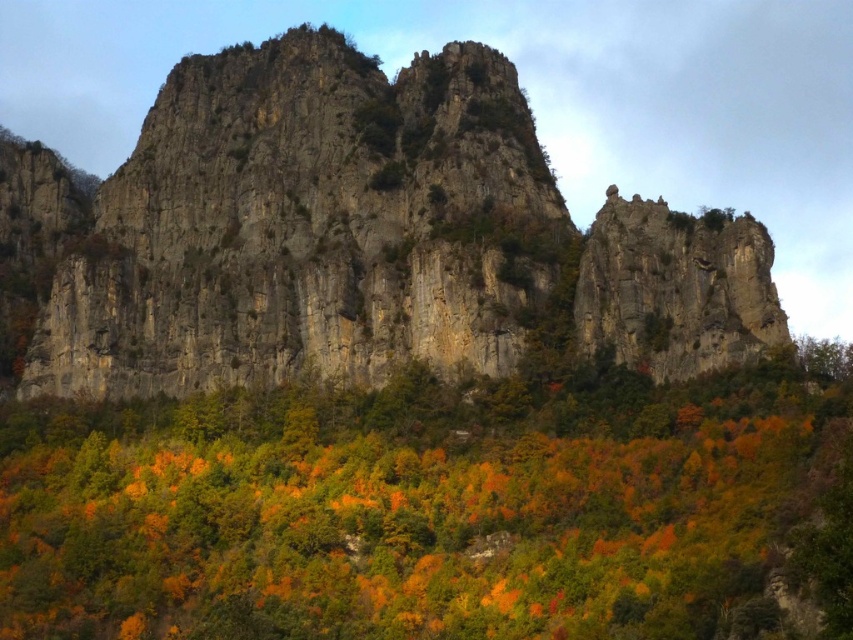
You are standing at the base of the cliff and looking upward. There are two points marked on the cliff face. The first point is at coordinates point (773,353), and the second is at point (601,228). Which of these points is closer to you from your vantage point?

Point (773,353) is in front of point (601,228), so it is closer to your vantage point at the base of the cliff.

You are standing at the base of the towering cliff and see an orange matte tree at center. Can you confirm if the orange matte tree at center is exactly at the point marked as point (x=436, y=508)?

The orange matte tree at center is located at point (x=436, y=508), so yes, the orange matte tree at center is exactly at the point marked as point 0.794, 0.794.

You are a hiker standing at the base of the rocky cliff at center and looking up. You notice an orange matte tree at center in the distance. Which object appears closer to you in this view?

The orange matte tree at center appears closer to you because it has a smaller size compared to the rocky cliff at center, which is larger and likely farther away.